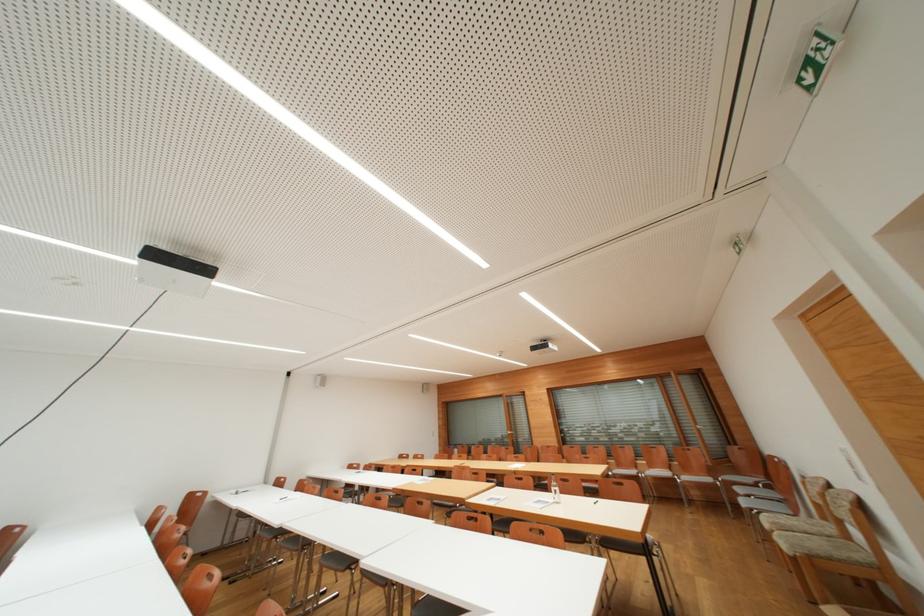
What do you see at coordinates (704, 414) in the screenshot?
I see `the window handle` at bounding box center [704, 414].